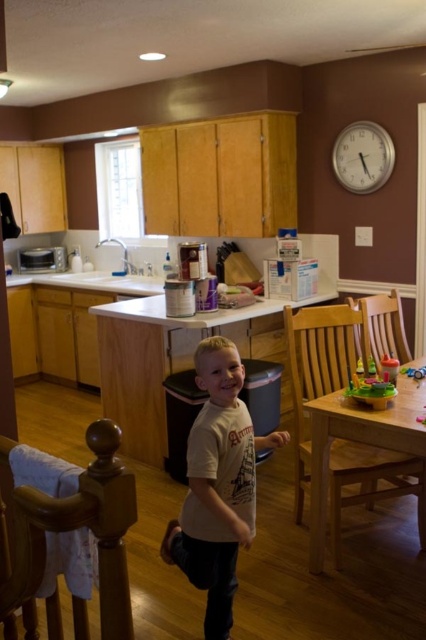
Question: Which point appears farthest from the camera in this image?

Choices:
 (A) (368, 308)
 (B) (273, 442)
 (C) (351, 397)
 (D) (412, 397)

Answer: (A)

Question: Is light beige cotton shirt at center to the right of translucent plastic toy at table from the viewer's perspective?

Choices:
 (A) yes
 (B) no

Answer: (B)

Question: Based on their relative distances, which object is farther from the light beige cotton shirt at center?

Choices:
 (A) wooden chair at lower left
 (B) light brown wooden table at lower right
 (C) translucent plastic toy at table
 (D) wooden chair at right

Answer: (D)

Question: Which point appears closest to the camera in this image?

Choices:
 (A) pyautogui.click(x=310, y=513)
 (B) pyautogui.click(x=363, y=378)
 (C) pyautogui.click(x=112, y=429)

Answer: (C)

Question: Is wooden chair at lower left bigger than wooden chair at right?

Choices:
 (A) no
 (B) yes

Answer: (A)

Question: Does wooden table at center come behind wooden chair at right?

Choices:
 (A) no
 (B) yes

Answer: (B)